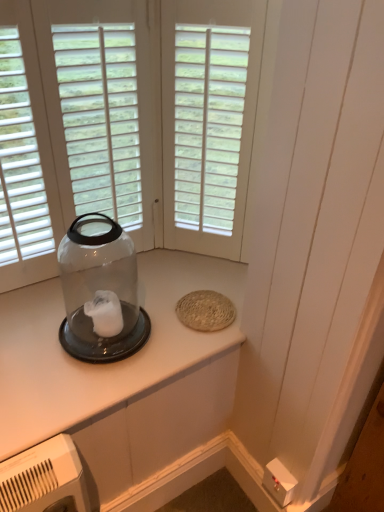
Locate an element on the screen. This screenshot has height=512, width=384. space that is in front of white matte window at center is located at coordinates (195, 279).